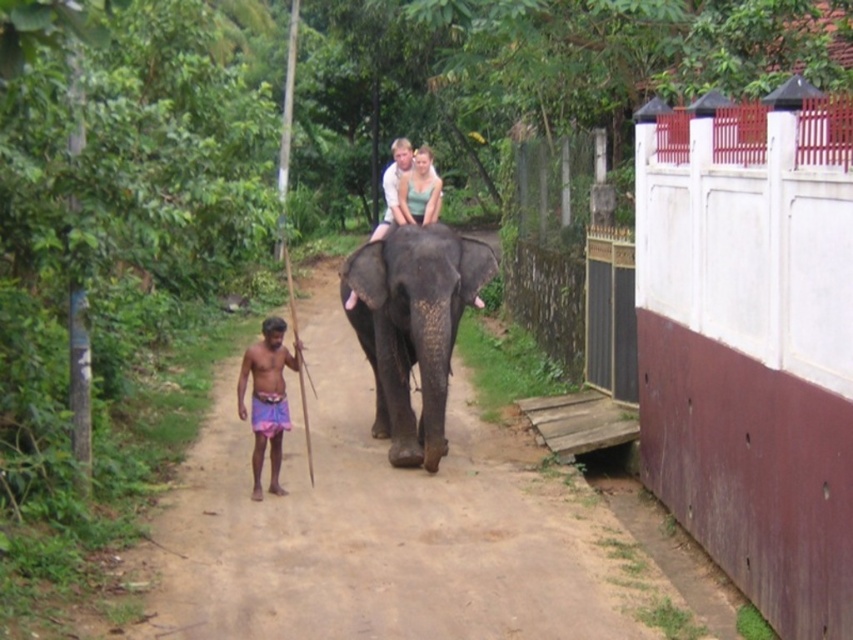
Does point (555, 557) lie behind point (374, 330)?

No.

Does brown dirt path at center have a larger size compared to dark gray textured elephant at center?

Indeed, brown dirt path at center has a larger size compared to dark gray textured elephant at center.

Does point (276, 506) lie behind point (376, 289)?

No, (276, 506) is closer to viewer.

Where is `brown dirt path at center`? This screenshot has height=640, width=853. brown dirt path at center is located at coordinates (381, 528).

Is dark gray textured elephant at center taller than pink fabric shorts at lower center?

Indeed, dark gray textured elephant at center has a greater height compared to pink fabric shorts at lower center.

Who is positioned more to the left, dark gray textured elephant at center or pink fabric shorts at lower center?

Positioned to the left is pink fabric shorts at lower center.

Who is more distant from viewer, (395, 464) or (270, 326)?

The point (395, 464) is behind.

Where is `dark gray textured elephant at center`? The image size is (853, 640). dark gray textured elephant at center is located at coordinates (413, 326).

How much distance is there between pink fabric shorts at lower center and green textured top at center?

2.22 meters

Can you confirm if pink fabric shorts at lower center is positioned to the left of green textured top at center?

Indeed, pink fabric shorts at lower center is positioned on the left side of green textured top at center.

Measure the distance between pink fabric shorts at lower center and camera.

A distance of 26.75 feet exists between pink fabric shorts at lower center and camera.

This screenshot has width=853, height=640. I want to click on pink fabric shorts at lower center, so click(x=267, y=397).